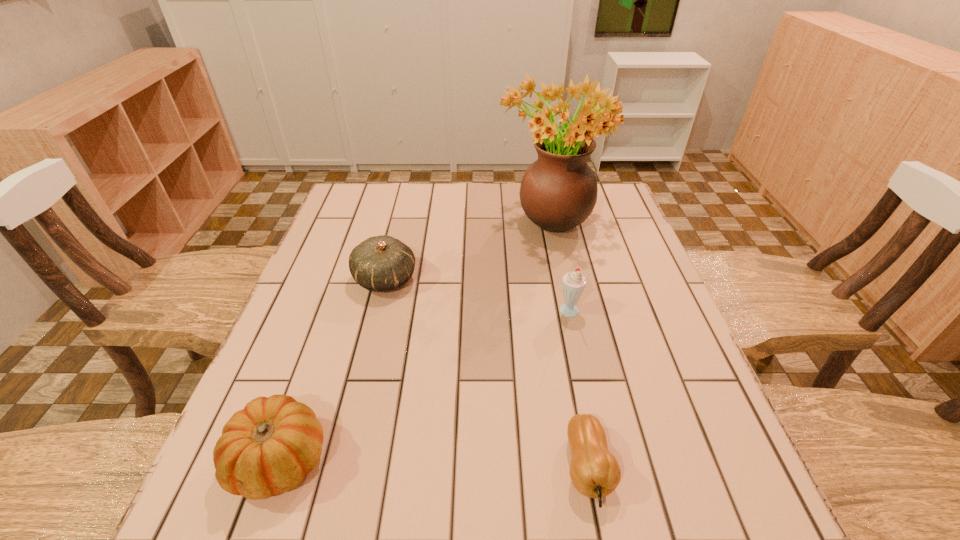
This screenshot has height=540, width=960. I want to click on flower arrangement, so click(558, 192).

Image resolution: width=960 pixels, height=540 pixels. What are the coordinates of `the tallest object` in the screenshot? It's located at (558, 192).

At what (x,y) coordinates should I click in order to perform the action: click on the fourth shortest object. Please return your answer as a coordinate pair (x, y). The image size is (960, 540). Looking at the image, I should click on (573, 282).

At what (x,y) coordinates should I click in order to perform the action: click on milkshake. Please return your answer as a coordinate pair (x, y). Looking at the image, I should click on (573, 282).

Where is `the farthest gourd`? The image size is (960, 540). the farthest gourd is located at coordinates (380, 263).

Identify the location of the rightmost gourd. [594, 471].

I want to click on the shortest object, so click(594, 471).

You are a GUI agent. You are given a task and a screenshot of the screen. Output one action in this format:
    pyautogui.click(x=<x>, y=<y>)
    Task: Click on the free space located on the right of the tallest object
    The height and width of the screenshot is (540, 960).
    Given the screenshot: What is the action you would take?
    pyautogui.click(x=618, y=218)

Identify the location of blank space located on the straw side of the third nearest object. (473, 313).

Identify the location of free space located on the straw side of the third nearest object. (452, 313).